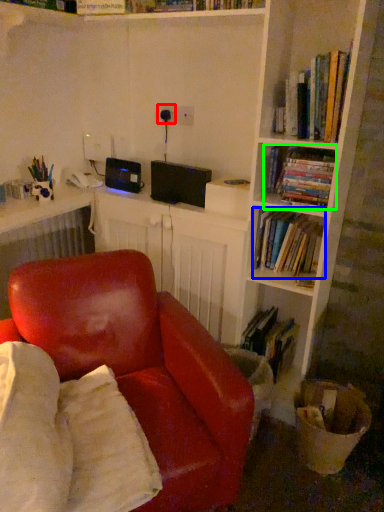
Question: Considering the real-world distances, which object is farthest from electric outlet (highlighted by a red box)? book (highlighted by a blue box) or book (highlighted by a green box)?

Choices:
 (A) book
 (B) book

Answer: (A)